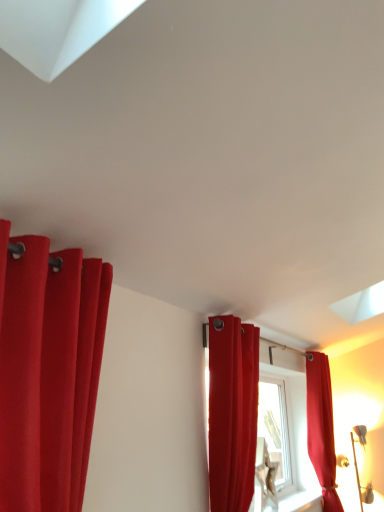
Question: Considering the relative sizes of matte red curtain at right, placed as the 3th curtain when sorted from front to back, and matte red curtain at left, the 1th curtain from the left, in the image provided, is matte red curtain at right, placed as the 3th curtain when sorted from front to back, smaller than matte red curtain at left, the 1th curtain from the left,?

Choices:
 (A) no
 (B) yes

Answer: (A)

Question: From a real-world perspective, is matte red curtain at right, the 1th curtain when ordered from back to front, positioned over matte red curtain at left, arranged as the 3th curtain when viewed from the right, based on gravity?

Choices:
 (A) no
 (B) yes

Answer: (A)

Question: Could you tell me if matte red curtain at right, the 3th curtain viewed from the left, is facing matte red curtain at left, which is the 1th curtain in front-to-back order?

Choices:
 (A) yes
 (B) no

Answer: (B)

Question: Is matte red curtain at right, the 1th curtain from the right, bigger than matte red curtain at left, which ranks as the third curtain in back-to-front order?

Choices:
 (A) yes
 (B) no

Answer: (A)

Question: Is matte red curtain at right, the 3th curtain viewed from the left, in contact with matte red curtain at left, which is the 1th curtain in front-to-back order?

Choices:
 (A) no
 (B) yes

Answer: (A)

Question: From their relative heights in the image, would you say matte red curtain at right, the 3th curtain viewed from the left, is taller or shorter than matte red curtain at center, which is counted as the 2th curtain, starting from the left?

Choices:
 (A) tall
 (B) short

Answer: (A)

Question: Considering the positions of matte red curtain at right, placed as the 3th curtain when sorted from front to back, and matte red curtain at center, which is counted as the 2th curtain, starting from the left, in the image, is matte red curtain at right, placed as the 3th curtain when sorted from front to back, wider or thinner than matte red curtain at center, which is counted as the 2th curtain, starting from the left,?

Choices:
 (A) thin
 (B) wide

Answer: (B)

Question: From the image's perspective, is matte red curtain at right, the 1th curtain when ordered from back to front, above or below matte red curtain at center, which ranks as the second curtain in back-to-front order?

Choices:
 (A) above
 (B) below

Answer: (B)

Question: Is point (316, 422) closer or farther from the camera than point (228, 370)?

Choices:
 (A) farther
 (B) closer

Answer: (A)

Question: Is matte red curtain at center, which is the second curtain in right-to-left order, wider or thinner than matte red curtain at left, which is the 1th curtain in front-to-back order?

Choices:
 (A) wide
 (B) thin

Answer: (B)

Question: In terms of size, does matte red curtain at center, which is the second curtain in right-to-left order, appear bigger or smaller than matte red curtain at left, which ranks as the third curtain in back-to-front order?

Choices:
 (A) small
 (B) big

Answer: (B)

Question: From the image's perspective, relative to matte red curtain at left, the 1th curtain from the left, is matte red curtain at center, which is the second curtain in right-to-left order, above or below?

Choices:
 (A) above
 (B) below

Answer: (B)

Question: Based on their positions, is matte red curtain at center, which is the second curtain in right-to-left order, located to the left or right of matte red curtain at left, which ranks as the third curtain in back-to-front order?

Choices:
 (A) right
 (B) left

Answer: (A)

Question: From the image's perspective, is matte red curtain at left, the 1th curtain from the left, located above or below matte red curtain at right, the 1th curtain from the right?

Choices:
 (A) below
 (B) above

Answer: (B)

Question: Is matte red curtain at left, arranged as the 3th curtain when viewed from the right, inside the boundaries of matte red curtain at right, the 3th curtain viewed from the left, or outside?

Choices:
 (A) outside
 (B) inside

Answer: (A)